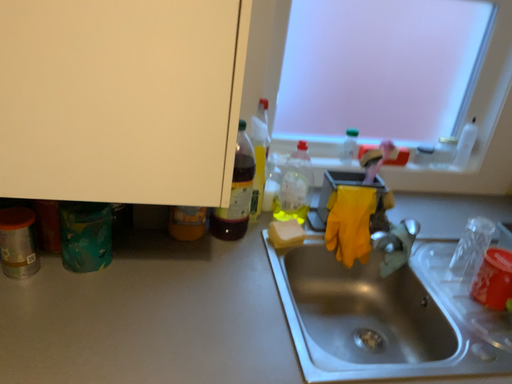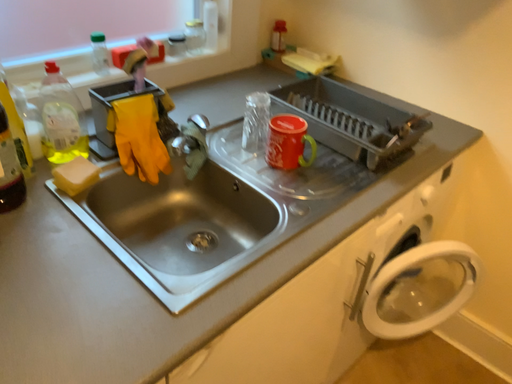
Question: How did the camera likely rotate when shooting the video?

Choices:
 (A) rotated right
 (B) rotated left

Answer: (A)